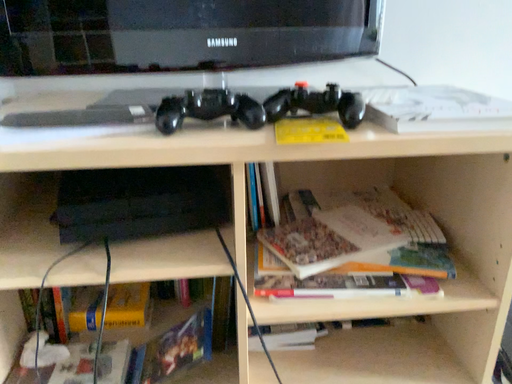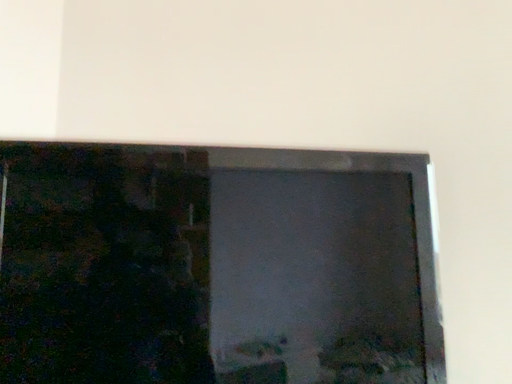
Question: Which way did the camera rotate in the video?

Choices:
 (A) rotated left
 (B) rotated right

Answer: (A)